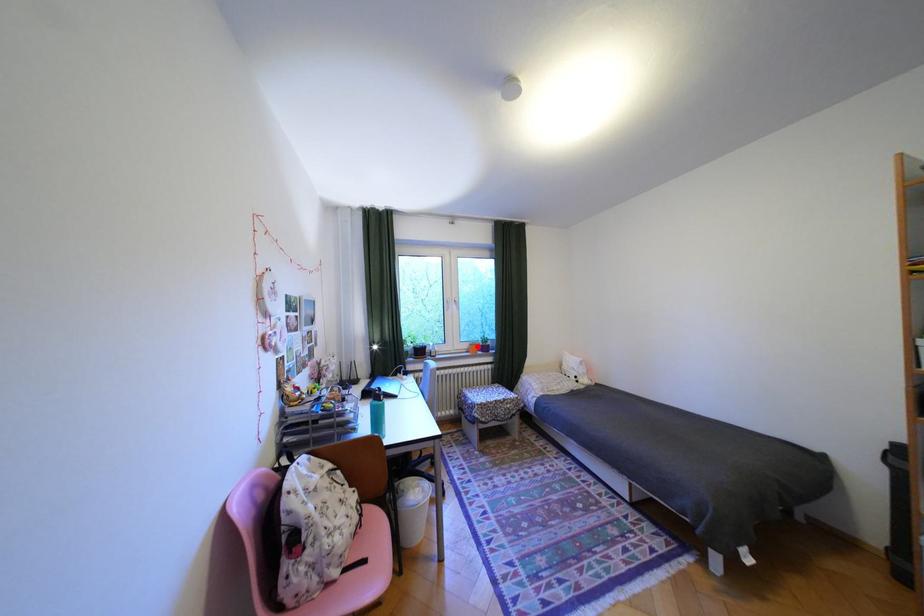
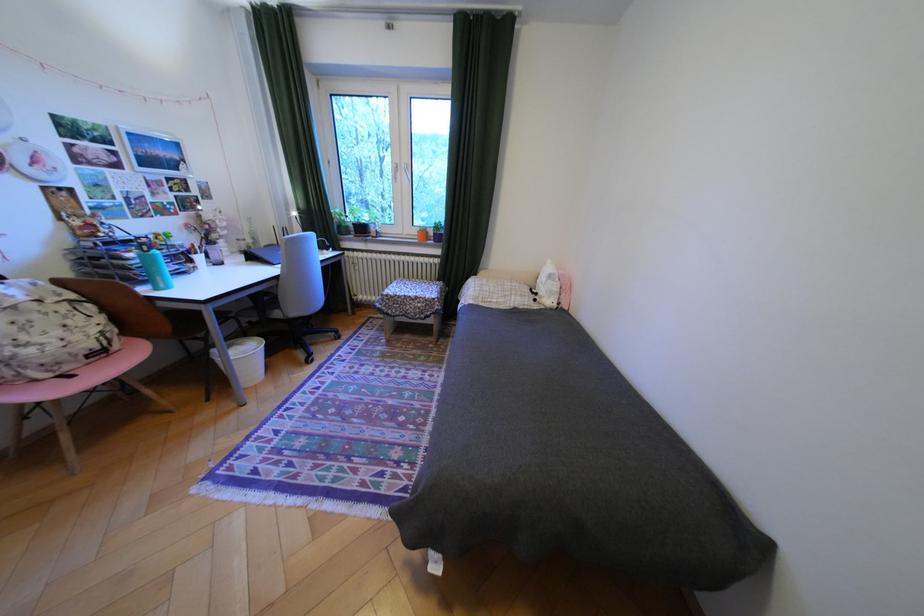
Question: I am providing you with two images of the same scene from different viewpoints. In image1, a red point is highlighted. Considering the same 3D point in image2, which of the following is correct?

Choices:
 (A) It is closer
 (B) It is farther

Answer: (A)